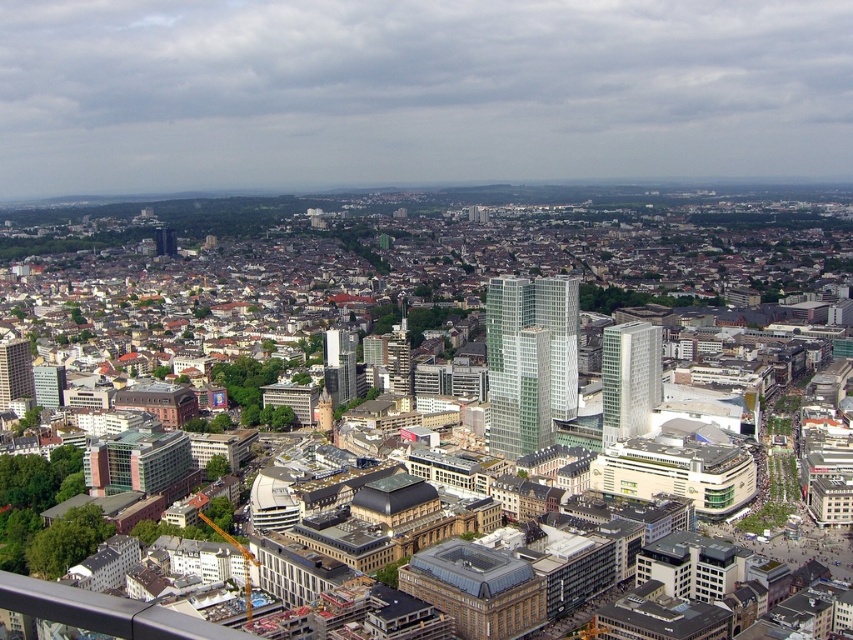
Is white glass skyscraper at center shorter than glassy skyscraper at center?

No.

Which of these two, white glass skyscraper at center or glassy skyscraper at center, stands shorter?

glassy skyscraper at center

Does point (643, 380) come behind point (346, 378)?

No.

Locate an element on the screen. white glass skyscraper at center is located at coordinates (630, 378).

Does glassy skyscraper at center have a greater height compared to matte glass skyscraper at center-left?

Correct, glassy skyscraper at center is much taller as matte glass skyscraper at center-left.

Who is shorter, glassy skyscraper at center or matte glass skyscraper at center-left?

matte glass skyscraper at center-left is shorter.

Where is `glassy skyscraper at center`? The width and height of the screenshot is (853, 640). glassy skyscraper at center is located at coordinates (339, 365).

Can you confirm if white glass skyscraper at center is shorter than matte glass skyscraper at center-left?

No, white glass skyscraper at center is not shorter than matte glass skyscraper at center-left.

Does white glass skyscraper at center have a smaller size compared to matte glass skyscraper at center-left?

No.

This screenshot has width=853, height=640. Identify the location of white glass skyscraper at center. (630, 378).